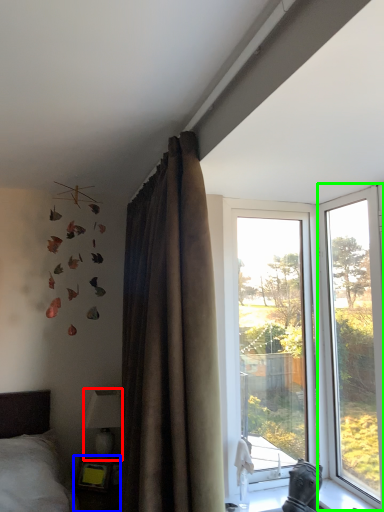
Question: Estimate the real-world distances between objects in this image. Which object is closer to lamp (highlighted by a red box), table (highlighted by a blue box) or window (highlighted by a green box)?

Choices:
 (A) table
 (B) window

Answer: (A)